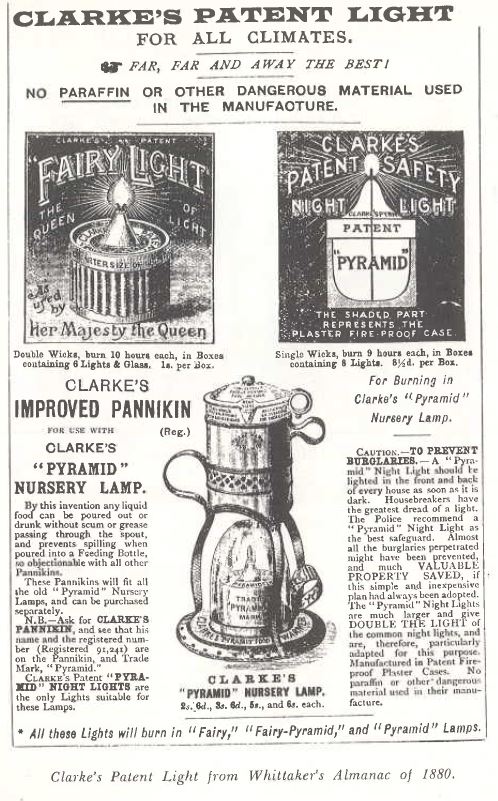
Locate an element on the screen. The height and width of the screenshot is (801, 498). candle flame is located at coordinates (249, 553), (115, 187), (372, 163).